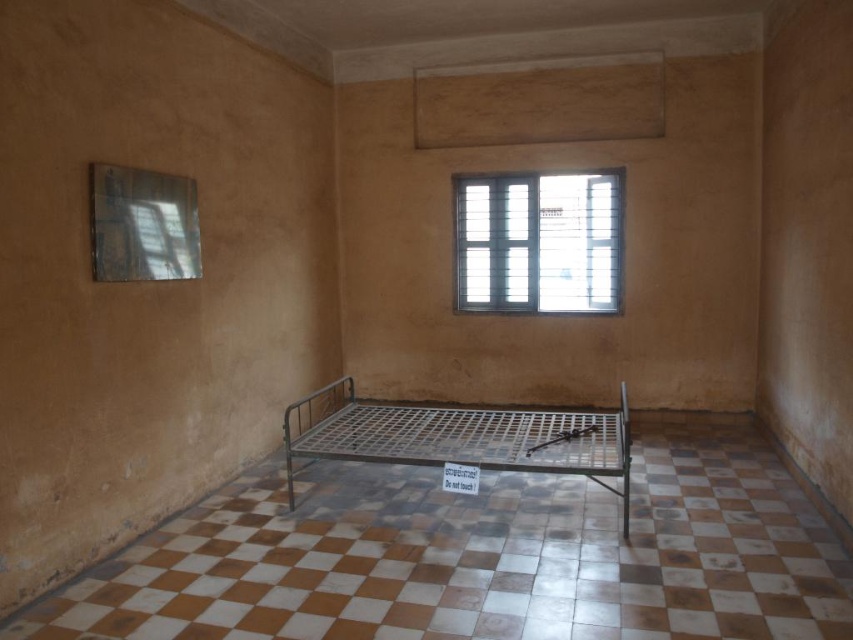
Between clear glass window at upper center and metallic grid bed at center, which one has more height?

clear glass window at upper center is taller.

You are a GUI agent. You are given a task and a screenshot of the screen. Output one action in this format:
    pyautogui.click(x=<x>, y=<y>)
    Task: Click on the clear glass window at upper center
    The image size is (853, 640).
    Given the screenshot: What is the action you would take?
    pyautogui.click(x=538, y=241)